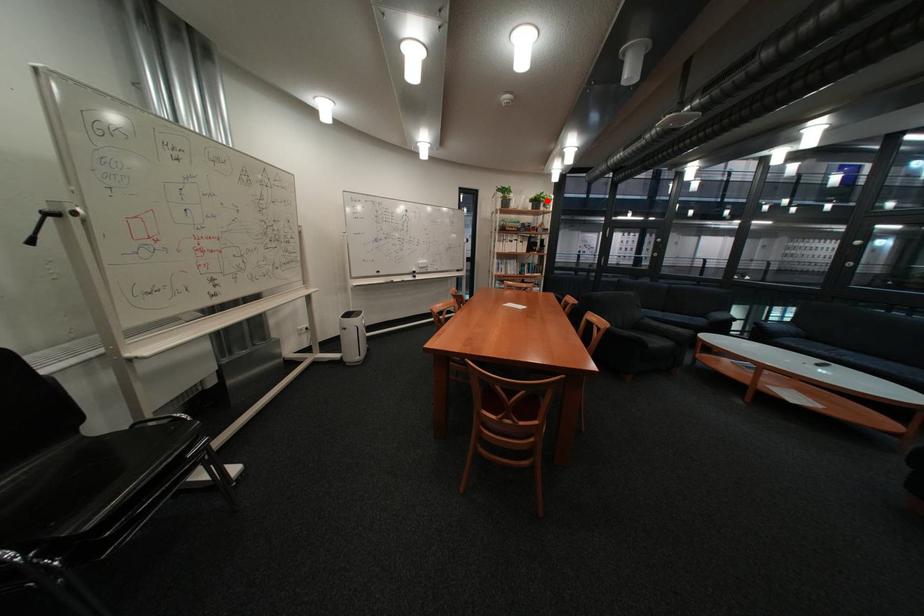
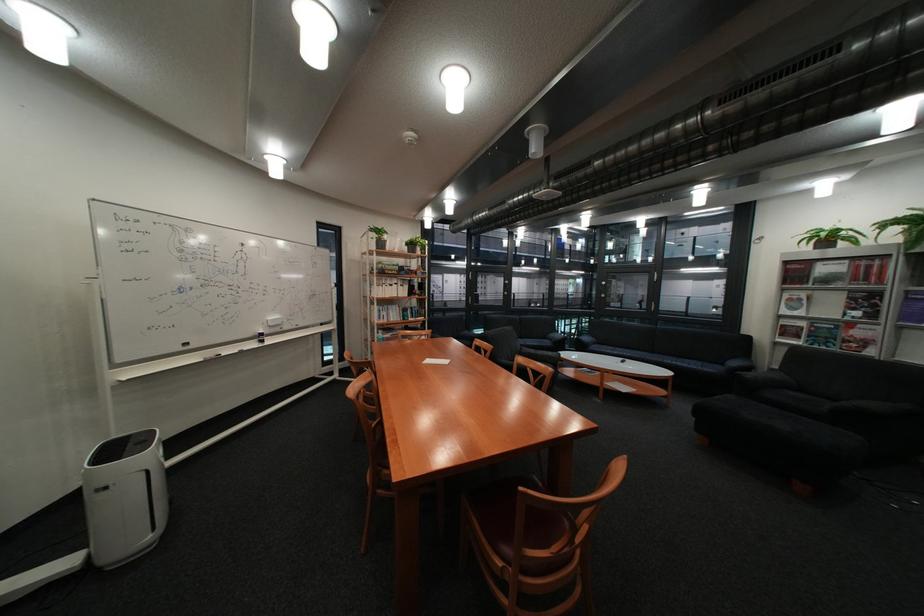
Locate, in the second image, the point that corresponds to the highlighted location in the first image.

(421, 245)